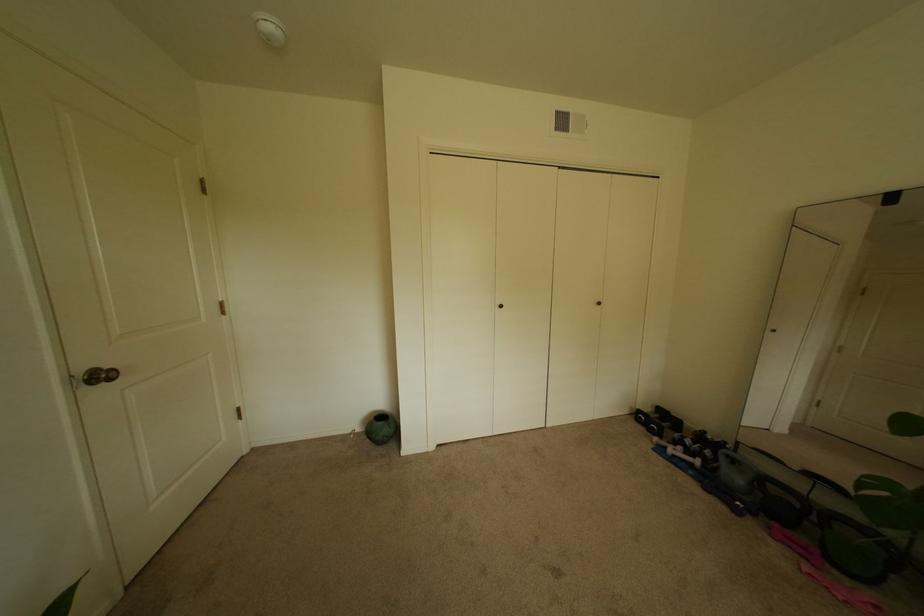
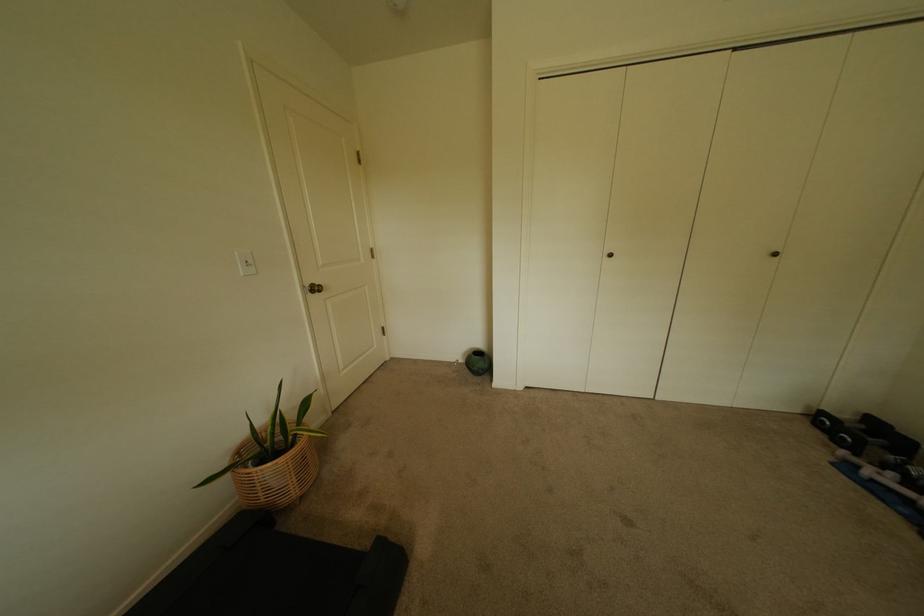
Find the pixel in the second image that matches (89,373) in the first image.

(315, 286)